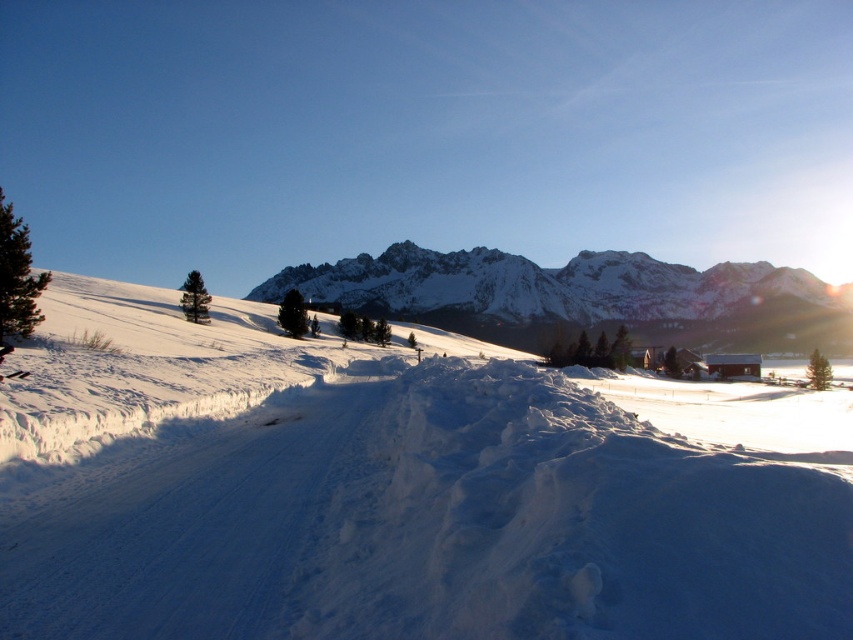
How much distance is there between white fluffy snow at center and white snow-covered mountain at center?

A distance of 225.39 meters exists between white fluffy snow at center and white snow-covered mountain at center.

Between white fluffy snow at center and white snow-covered mountain at center, which one appears on the right side from the viewer's perspective?

white snow-covered mountain at center is more to the right.

At what (x,y) coordinates should I click in order to perform the action: click on white fluffy snow at center. Please return your answer as a coordinate pair (x, y). The image size is (853, 640). Looking at the image, I should click on (378, 497).